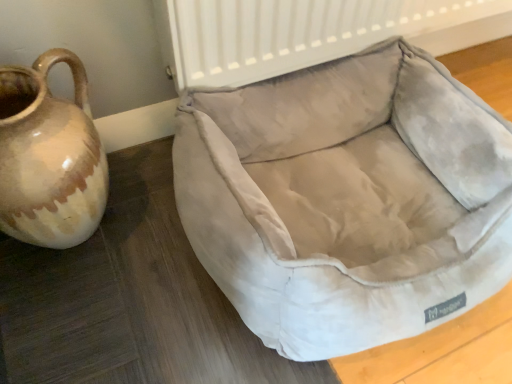
You are a GUI agent. You are given a task and a screenshot of the screen. Output one action in this format:
    pyautogui.click(x=<x>, y=<y>)
    Task: Click on the unoccupied region to the right of brown glazed jug at left
    This screenshot has height=384, width=512.
    Given the screenshot: What is the action you would take?
    pyautogui.click(x=159, y=238)